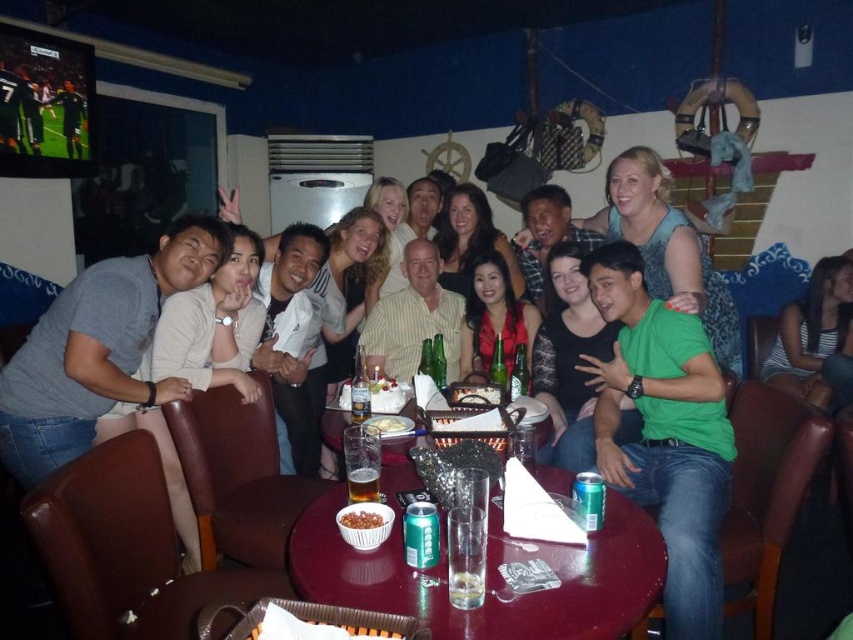
You are at the dining table and want to locate the striped fabric shirt at right. Where exactly is it positioned relative to the table?

The striped fabric shirt at right is positioned at coordinates point 0.522 on the x axis and 0.954 on the y axis relative to the table.